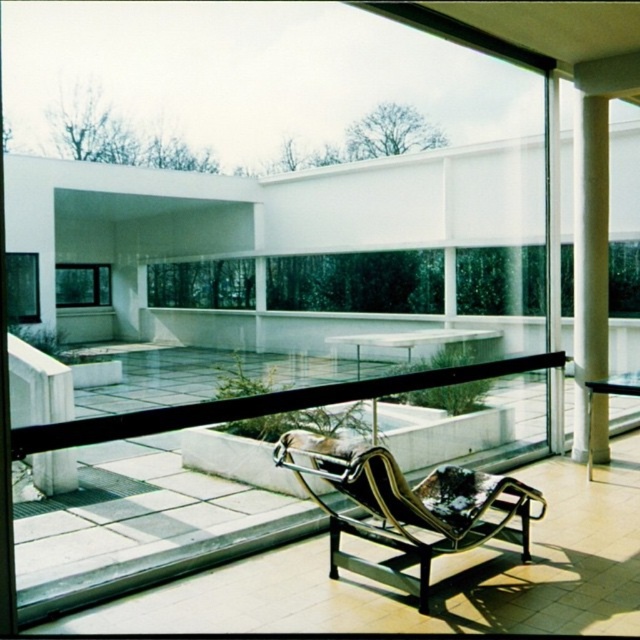
Question: Does metallic black chaise lounge at lower center appear under transparent glass window at lower left?

Choices:
 (A) yes
 (B) no

Answer: (A)

Question: Which point is closer to the camera taking this photo?

Choices:
 (A) (28, 268)
 (B) (348, 563)
 (C) (598, 225)

Answer: (B)

Question: Can you confirm if metallic black chaise lounge at lower center is positioned to the left of white concrete column at right?

Choices:
 (A) no
 (B) yes

Answer: (B)

Question: Which object appears closest to the camera in this image?

Choices:
 (A) white concrete column at right
 (B) metallic black chaise lounge at lower center
 (C) clear glass window at upper left
 (D) transparent glass window at center

Answer: (B)

Question: Is metallic black chaise lounge at lower center below clear glass window at upper left?

Choices:
 (A) no
 (B) yes

Answer: (B)

Question: Which object is farther from the camera taking this photo?

Choices:
 (A) white concrete column at right
 (B) transparent glass window at center

Answer: (B)